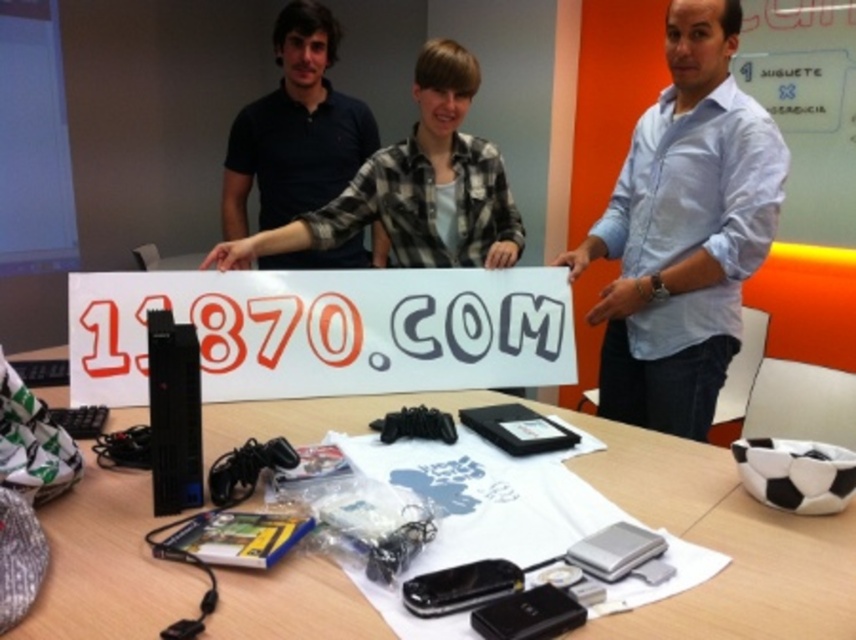
You are a photographer standing in front of the table where the white paper sign at center and plaid shirt at center are located. You want to take a photo that clearly shows both items. Which item should you focus on first to ensure both are in focus?

You should focus on the plaid shirt at center first because the white paper sign at center is closer to the viewer, so focusing on the farther object ensures both will be in focus.

You are a photographer taking a picture of the light blue shirt at center and the plaid shirt at center. To ensure both are fully visible in the photo, which shirt should you adjust to be closer to the camera?

The plaid shirt at center should be moved closer to the camera because the light blue shirt at center is currently in front of it, blocking part of the plaid shirt at center.